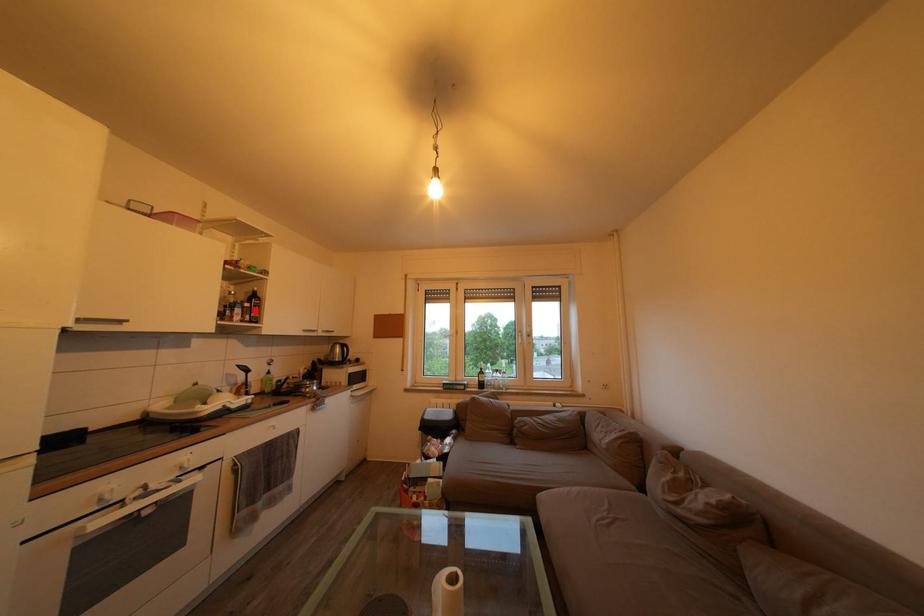
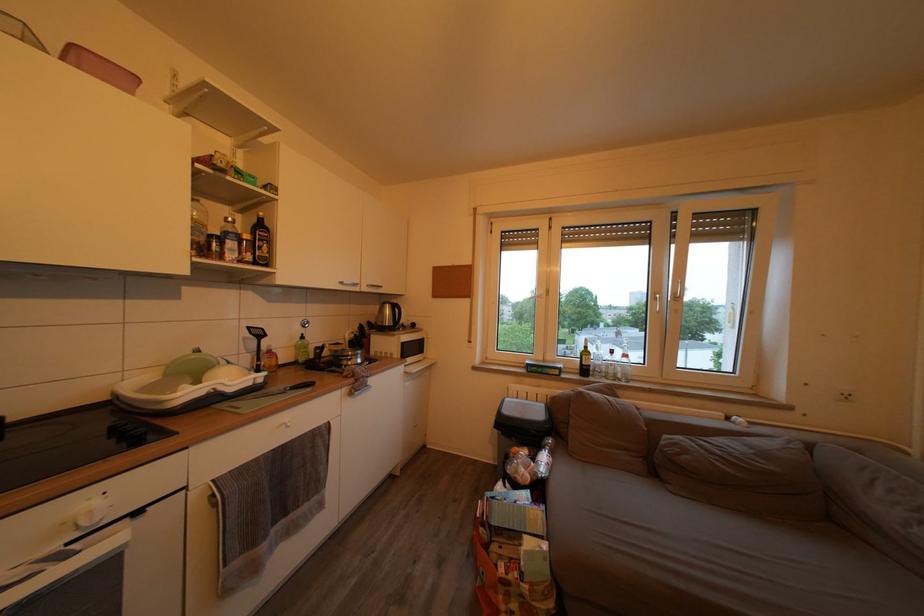
The point at the highlighted location is marked in the first image. Where is the corresponding point in the second image?

(253, 243)